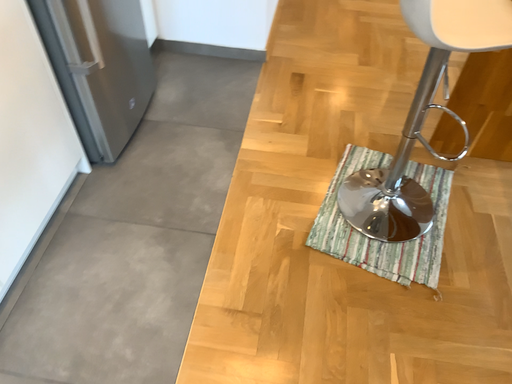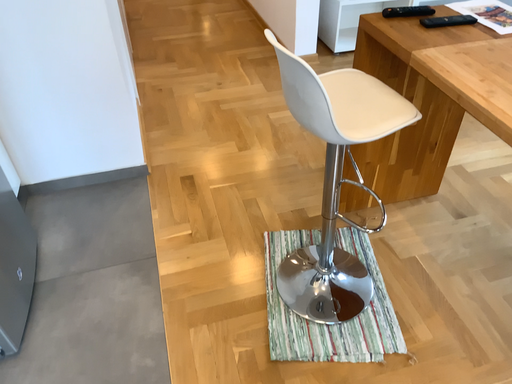
Question: Which way did the camera rotate in the video?

Choices:
 (A) rotated right
 (B) rotated left

Answer: (A)